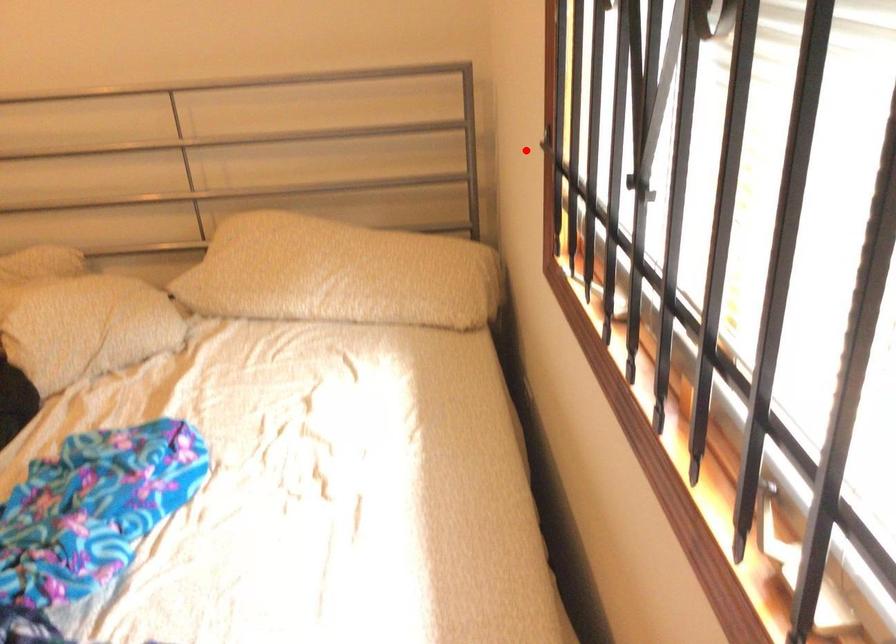
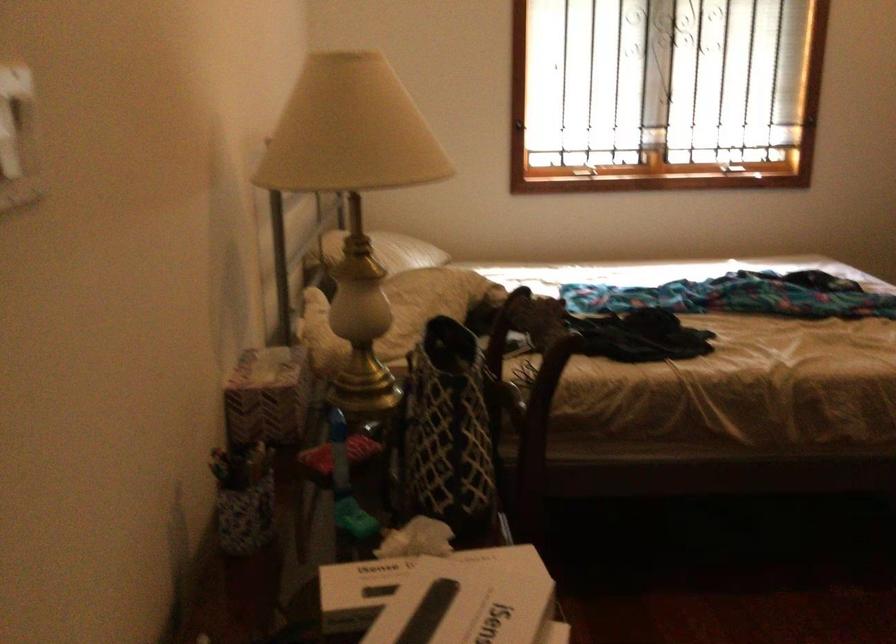
Locate, in the second image, the point that corresponds to the highlighted location in the first image.

(520, 124)